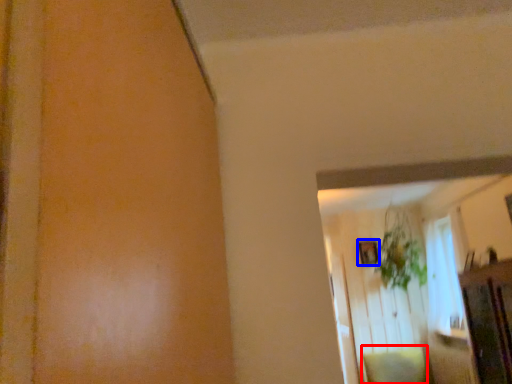
Question: Which object appears closest to the camera in this image, pillow (highlighted by a red box) or picture frame (highlighted by a blue box)?

Choices:
 (A) pillow
 (B) picture frame

Answer: (A)